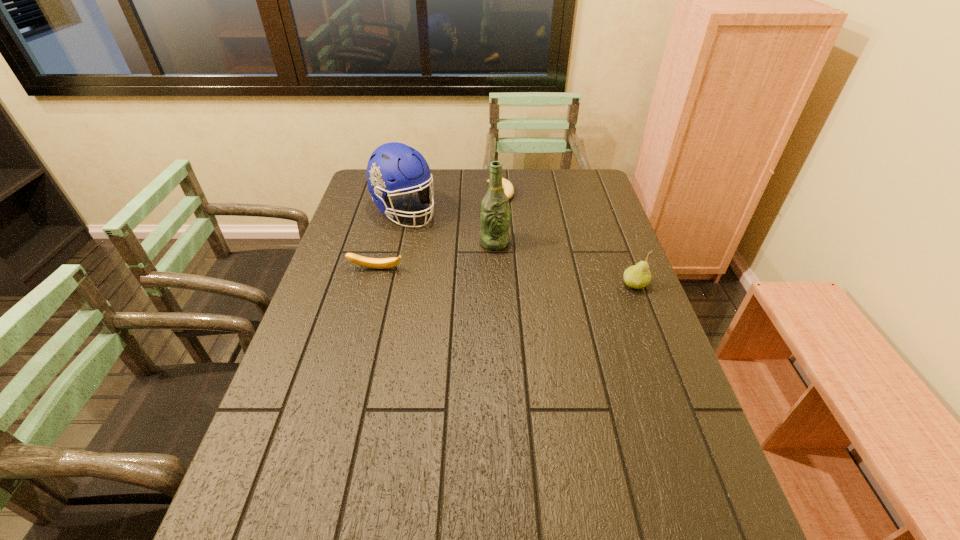
Locate an element on the screen. This screenshot has width=960, height=540. free space located on the face guard of the second tallest object is located at coordinates (459, 258).

Where is `vacant space located 0.120m on the face guard of the second tallest object`? vacant space located 0.120m on the face guard of the second tallest object is located at coordinates (443, 244).

What are the coordinates of `vacant point located 0.390m on the face guard of the second tallest object` in the screenshot? It's located at coord(497,288).

What are the coordinates of `free space located 0.070m on the surface of the beer bottle` in the screenshot? It's located at (516, 262).

Image resolution: width=960 pixels, height=540 pixels. What are the coordinates of `vacant space located on the surface of the beer bottle` in the screenshot? It's located at (547, 291).

Locate an element on the screen. The image size is (960, 540). vacant area situated 0.140m on the surface of the beer bottle is located at coordinates (530, 275).

At what (x,y) coordinates should I click in order to perform the action: click on vacant region located at the stem of the shortest object. Please return your answer as a coordinate pair (x, y). Looking at the image, I should click on (535, 273).

This screenshot has height=540, width=960. Find the location of `vacant space located 0.240m at the stem of the shortest object`. vacant space located 0.240m at the stem of the shortest object is located at coordinates (522, 247).

At what (x,y) coordinates should I click in order to perform the action: click on vacant space located at the stem of the shortest object. Please return your answer as a coordinate pair (x, y). Looking at the image, I should click on (516, 232).

Where is `football helmet located in the far edge section of the desktop`? The image size is (960, 540). football helmet located in the far edge section of the desktop is located at coordinates (393, 167).